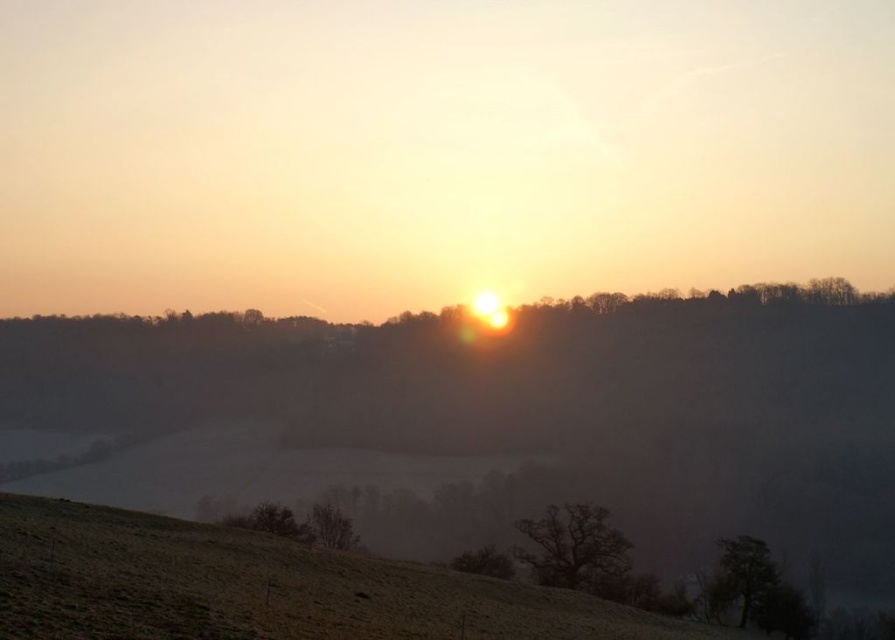
Question: Which object is the farthest from the dark brown textured tree at lower center?

Choices:
 (A) brown rough tree at lower center
 (B) dark brown textured tree at lower right
 (C) green matte tree at lower left
 (D) brown matte tree at lower center

Answer: (C)

Question: Is dark brown textured tree at lower right thinner than brown rough tree at lower center?

Choices:
 (A) yes
 (B) no

Answer: (A)

Question: Can you confirm if brown matte tree at lower center is positioned above brown rough tree at lower center?

Choices:
 (A) yes
 (B) no

Answer: (A)

Question: Which point appears farthest from the camera in this image?

Choices:
 (A) (570, 556)
 (B) (226, 516)

Answer: (B)

Question: Which point is closer to the camera?

Choices:
 (A) green matte tree at lower left
 (B) dark brown textured tree at lower right

Answer: (A)

Question: Is dark brown textured tree at lower right to the left of brown matte tree at lower center from the viewer's perspective?

Choices:
 (A) yes
 (B) no

Answer: (B)